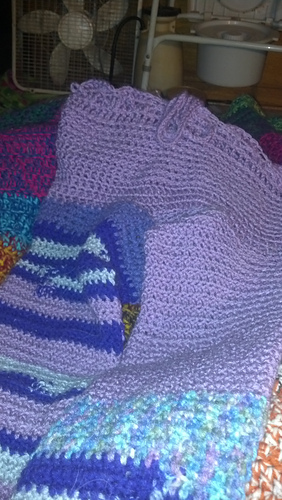
In order to click on fan in this screenshot , I will do `click(80, 28)`.